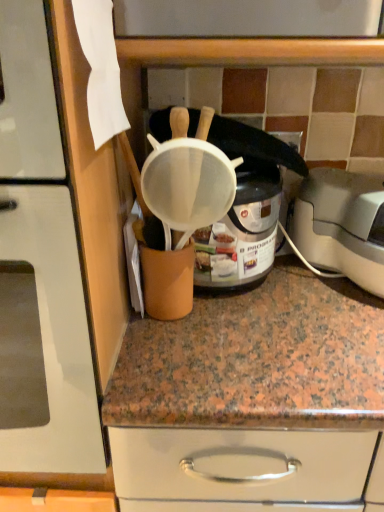
Where is `free location above white plastic toaster at right (from a real-world perspective)`? This screenshot has height=512, width=384. free location above white plastic toaster at right (from a real-world perspective) is located at coordinates (355, 179).